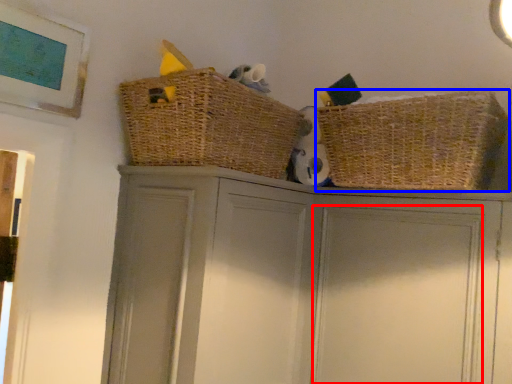
Question: Which object appears farthest to the camera in this image, door (highlighted by a red box) or basket (highlighted by a blue box)?

Choices:
 (A) door
 (B) basket

Answer: (A)